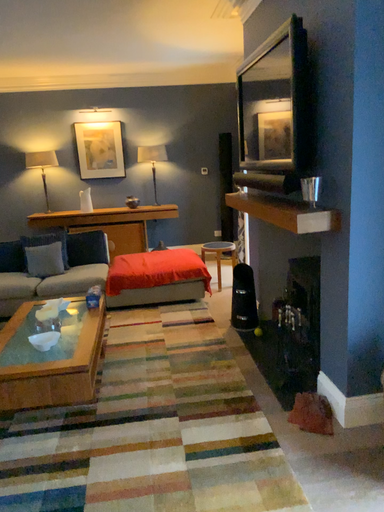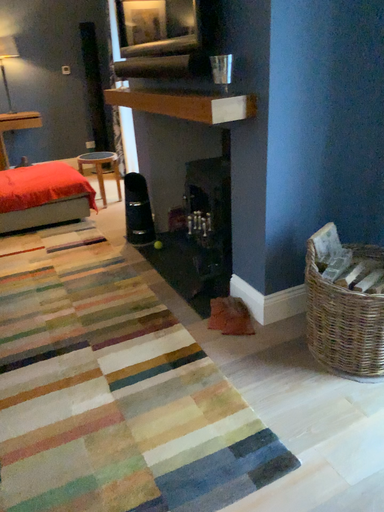
Question: Which way did the camera rotate in the video?

Choices:
 (A) rotated left
 (B) rotated right

Answer: (B)